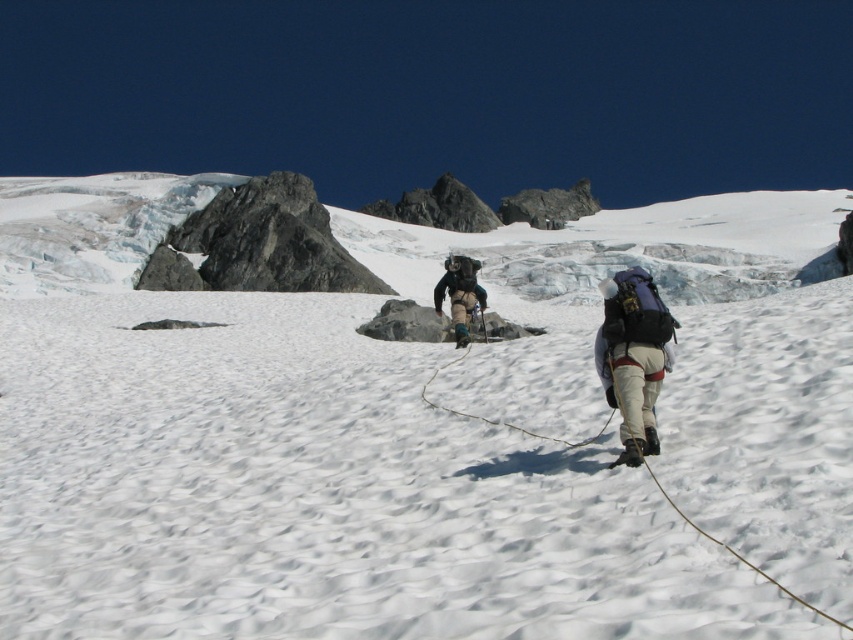
You are a mountaineer planning to move from the right side of the image towards the center. There are two backpacks in your path. Which backpack will you encounter first, the matte blue backpack at right or the dark gray fabric backpack at center?

The matte blue backpack at right is in front of the dark gray fabric backpack at center, so you will encounter the matte blue backpack at right first.

From the picture: You are planning to place a 1.2 meter wide tent on the white powdery snow at center. Considering the dark gray fabric backpack at center is already there, will the snow area be wide enough to accommodate the tent without overlapping the backpack?

The white powdery snow at center has a width larger than the dark gray fabric backpack at center. Since the snow area is wider, it can accommodate the 1.2 meter wide tent without overlapping the backpack as long as the backpack is positioned appropriately within the snow area.

You are a mountaineer planning to reach the point marked at coordinates point (627,364). Your current position is 10 meters away from the point. Can you safely reach the point without crossing the 13.29 meters distance limit set by your safety protocol?

The point (627,364) is 13.29 meters away from you. Since your current position is 10 meters away from the point, you can safely reach it without exceeding the 13.29 meters distance limit as 10 meters is less than 13.29 meters.